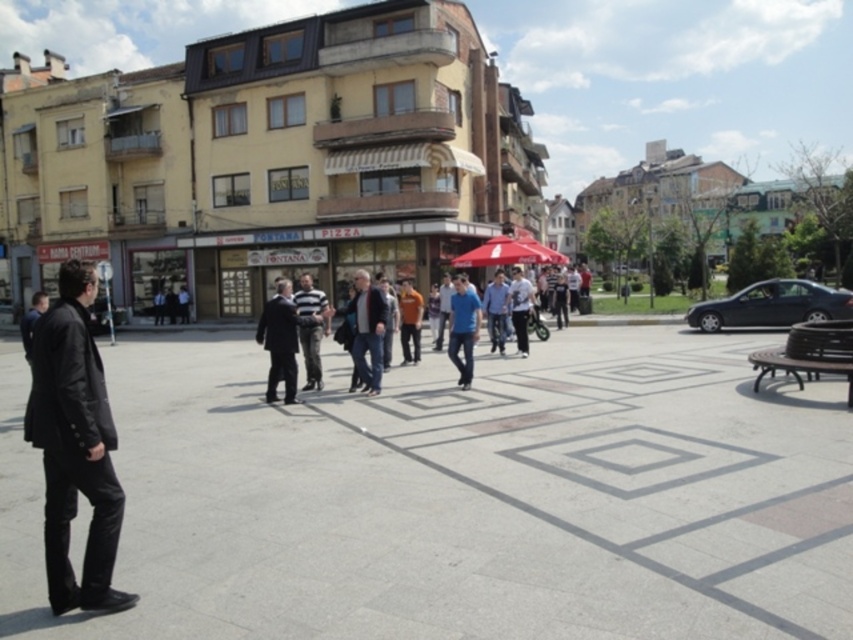
Question: Where is blue matte shirt at center located in relation to blue denim jeans at center in the image?

Choices:
 (A) below
 (B) above

Answer: (A)

Question: Is red fabric umbrella at center to the right of blue denim jeans at center from the viewer's perspective?

Choices:
 (A) no
 (B) yes

Answer: (B)

Question: Does blue matte shirt at center have a lesser width compared to striped cotton shirt at center?

Choices:
 (A) no
 (B) yes

Answer: (B)

Question: Among these points, which one is farthest from the camera?

Choices:
 (A) (376, 362)
 (B) (503, 262)
 (C) (44, 400)

Answer: (B)

Question: Which object appears closest to the camera in this image?

Choices:
 (A) dark gray jacket at center
 (B) dark blue suit at center

Answer: (B)

Question: Among these points, which one is farthest from the camera?

Choices:
 (A) (498, 348)
 (B) (512, 260)
 (C) (271, 349)

Answer: (B)